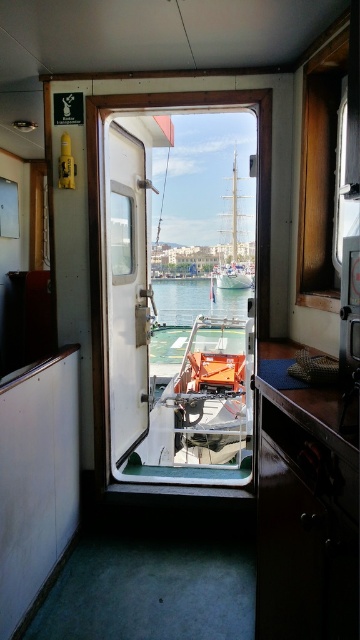
Looking at this image, you are standing inside the ship cabin and want to exit through the white glossy door at center. If your height is 6 feet tall, can you walk through the door without bending down?

The white glossy door at center is 9.73 feet away from viewer, so yes, you can walk through the door without bending down since the door height is likely taller than your 6 feet height.

You are standing inside the ship cabin and want to exit to the deck. The white glossy door at center is your only exit. However, you notice the clear blue water at center in your path. Is the door above or below the water level?

The white glossy door at center is below clear blue water at center, so the door is below the water level.

You are a delivery person trying to carry a large crate through the white glossy door at center. The crate is as wide as the clear blue water at center. Will the crate fit through the door?

The white glossy door at center has a lesser width compared to clear blue water at center. Since the crate is as wide as the clear blue water at center, it will not fit through the white glossy door at center.